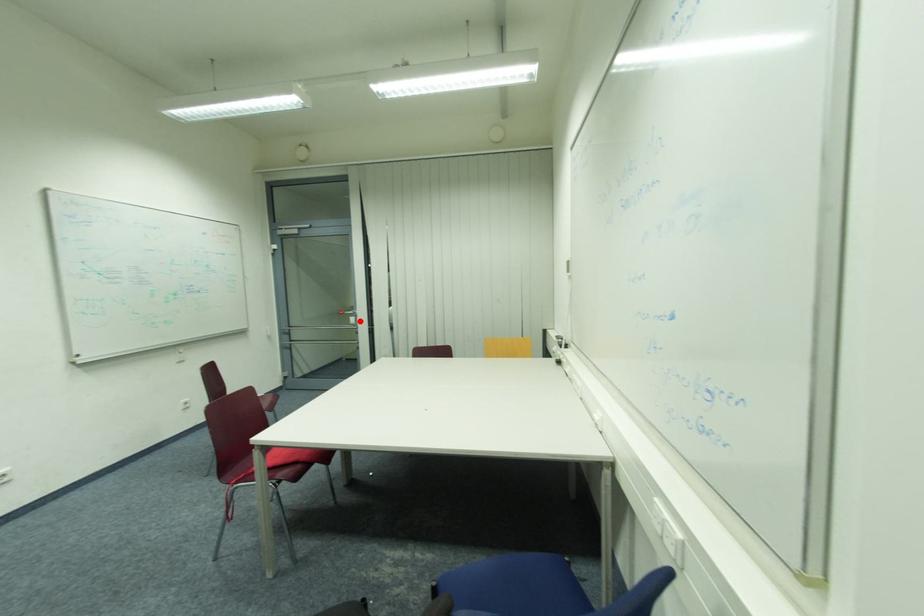
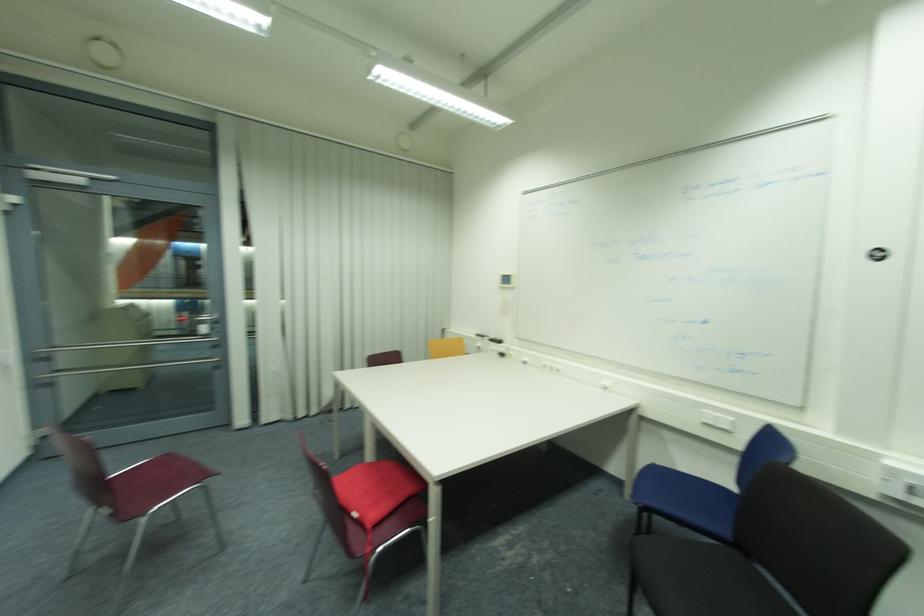
Question: A red point is marked in image1. In image2, is the corresponding 3D point closer to the camera or farther? Reply with the corresponding letter.

Choices:
 (A) The corresponding 3D point is closer.
 (B) The corresponding 3D point is farther.

Answer: (B)